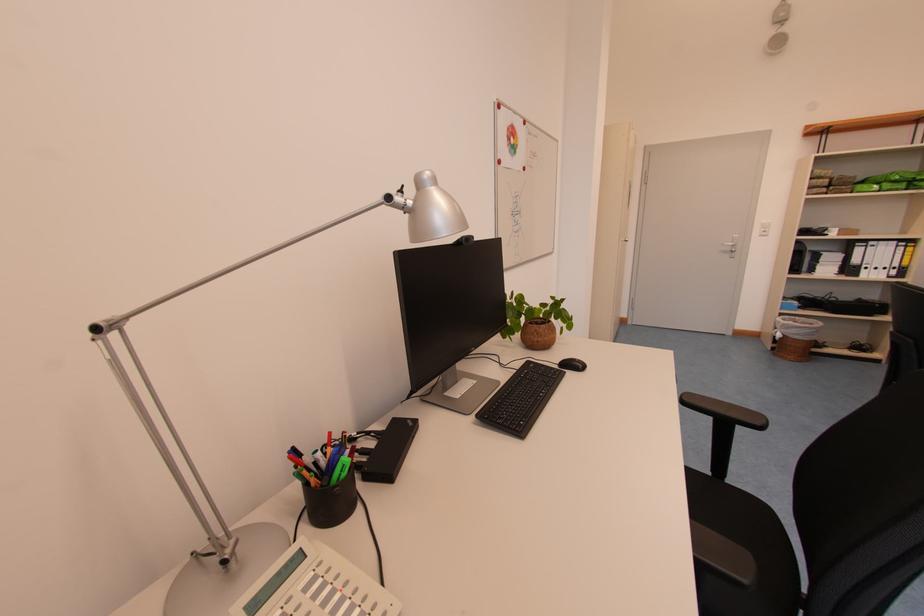
You are a GUI agent. You are given a task and a screenshot of the screen. Output one action in this format:
    pyautogui.click(x=<x>, y=<y>)
    Task: Click on the small potted plant
    
    Given the screenshot: What is the action you would take?
    pyautogui.click(x=535, y=321)